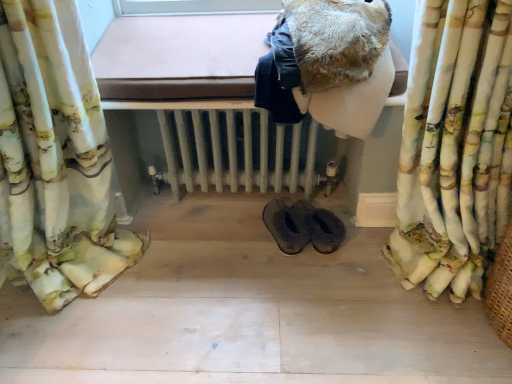
What is the approximate height of fluffy fabric curtain at right?

35.34 inches.

Measure the distance between black leather slippers at center and camera.

A distance of 1.45 meters exists between black leather slippers at center and camera.

At what (x,y) coordinates should I click in order to perform the action: click on fuzzy brown blanket at upper center. Please return your answer as a coordinate pair (x, y). The width and height of the screenshot is (512, 384). Looking at the image, I should click on (331, 65).

Is fuzzy brown blanket at upper center to the right of fluffy fabric curtain at right from the viewer's perspective?

Incorrect, fuzzy brown blanket at upper center is not on the right side of fluffy fabric curtain at right.

Is fuzzy brown blanket at upper center wider or thinner than fluffy fabric curtain at right?

Clearly, fuzzy brown blanket at upper center has more width compared to fluffy fabric curtain at right.

How much distance is there between fuzzy brown blanket at upper center and fluffy fabric curtain at right?

They are 10.81 inches apart.

Is fuzzy brown blanket at upper center bigger than fluffy fabric curtain at right?

No.

Is fuzzy brown blanket at upper center inside black leather slippers at center?

No, fuzzy brown blanket at upper center is not surrounded by black leather slippers at center.

Between black leather slippers at center and fuzzy brown blanket at upper center, which one is positioned behind?

black leather slippers at center is further away from the camera.

Looking at their sizes, would you say black leather slippers at center is wider or thinner than fuzzy brown blanket at upper center?

Clearly, black leather slippers at center has less width compared to fuzzy brown blanket at upper center.

Is black leather slippers at center next to fuzzy brown blanket at upper center and touching it?

No, black leather slippers at center is not in contact with fuzzy brown blanket at upper center.

Is point (392, 61) behind point (291, 208)?

No, (392, 61) is closer to viewer.

Does fuzzy brown blanket at upper center come behind black leather slippers at center?

No.

Considering the relative sizes of white painted radiator at center and fluffy fabric curtain at right in the image provided, is white painted radiator at center taller than fluffy fabric curtain at right?

No, white painted radiator at center is not taller than fluffy fabric curtain at right.

Can you confirm if white painted radiator at center is positioned to the left of fluffy fabric curtain at right?

Yes.

Which object is thinner, white painted radiator at center or fluffy fabric curtain at right?

fluffy fabric curtain at right.

From a real-world perspective, is white painted radiator at center physically located above or below fluffy fabric curtain at right?

Clearly, from a real-world perspective, white painted radiator at center is below fluffy fabric curtain at right.

From a real-world perspective, is fuzzy brown blanket at upper center beneath white painted radiator at center?

No, from a real-world perspective, fuzzy brown blanket at upper center is not beneath white painted radiator at center.

Between point (315, 17) and point (223, 119), which one is positioned behind?

The point (223, 119) is behind.

From the image's perspective, relative to white painted radiator at center, is fuzzy brown blanket at upper center above or below?

fuzzy brown blanket at upper center is above white painted radiator at center.

Which object is thinner, fuzzy brown blanket at upper center or white painted radiator at center?

fuzzy brown blanket at upper center.

Could you tell me if white painted radiator at center is turned towards black leather slippers at center?

No, white painted radiator at center is not turned towards black leather slippers at center.

You are a GUI agent. You are given a task and a screenshot of the screen. Output one action in this format:
    pyautogui.click(x=<x>, y=<y>)
    Task: Click on the footwear below the white painted radiator at center (from a real-world perspective)
    This screenshot has width=512, height=384.
    Given the screenshot: What is the action you would take?
    pyautogui.click(x=303, y=227)

From the image's perspective, is white painted radiator at center located beneath black leather slippers at center?

No, from the image's perspective, white painted radiator at center is not below black leather slippers at center.

How many degrees apart are the facing directions of white painted radiator at center and black leather slippers at center?

The facing directions of white painted radiator at center and black leather slippers at center are 74.2 degrees apart.

Would you consider fluffy fabric curtain at right to be distant from black leather slippers at center?

No, there isn't a large distance between fluffy fabric curtain at right and black leather slippers at center.

Does fluffy fabric curtain at right have a larger size compared to black leather slippers at center?

Correct, fluffy fabric curtain at right is larger in size than black leather slippers at center.

Consider the image. Which of these two, fluffy fabric curtain at right or black leather slippers at center, is wider?

Wider between the two is fluffy fabric curtain at right.

Is fluffy fabric curtain at right to the left or to the right of black leather slippers at center in the image?

Clearly, fluffy fabric curtain at right is on the right of black leather slippers at center in the image.

Image resolution: width=512 pixels, height=384 pixels. Find the location of `curtain that is below the fuzzy brown blanket at upper center (from the image's perspective)`. curtain that is below the fuzzy brown blanket at upper center (from the image's perspective) is located at coordinates (454, 146).

At what (x,y) coordinates should I click in order to perform the action: click on footwear behind the fuzzy brown blanket at upper center. Please return your answer as a coordinate pair (x, y). Looking at the image, I should click on (303, 227).

Estimate the real-world distances between objects in this image. Which object is closer to white painted radiator at center, fluffy fabric curtain at right or black leather slippers at center?

The object closer to white painted radiator at center is black leather slippers at center.

From the image, which object appears to be nearer to black leather slippers at center, white painted radiator at center or fluffy fabric curtain at right?

Among the two, white painted radiator at center is located nearer to black leather slippers at center.

Considering their positions, is black leather slippers at center positioned further to white painted radiator at center than fluffy fabric curtain at right?

The object further to white painted radiator at center is fluffy fabric curtain at right.

When comparing their distances from black leather slippers at center, does fluffy fabric curtain at right or white painted radiator at center seem further?

fluffy fabric curtain at right is further to black leather slippers at center.

Estimate the real-world distances between objects in this image. Which object is closer to fluffy fabric curtain at right, black leather slippers at center or white painted radiator at center?

black leather slippers at center is closer to fluffy fabric curtain at right.

From the image, which object appears to be farther from fuzzy brown blanket at upper center, fluffy fabric curtain at right or black leather slippers at center?

The object further to fuzzy brown blanket at upper center is black leather slippers at center.

Based on their spatial positions, is white painted radiator at center or fluffy fabric curtain at right closer to fuzzy brown blanket at upper center?

fluffy fabric curtain at right is positioned closer to the anchor fuzzy brown blanket at upper center.

From the image, which object appears to be farther from fluffy fabric curtain at right, black leather slippers at center or fuzzy brown blanket at upper center?

black leather slippers at center lies further to fluffy fabric curtain at right than the other object.

This screenshot has width=512, height=384. I want to click on clothing positioned between fluffy fabric curtain at right and white painted radiator at center from near to far, so click(x=331, y=65).

This screenshot has height=384, width=512. In order to click on clothing between fluffy fabric curtain at right and black leather slippers at center along the z-axis in this screenshot , I will do `click(331, 65)`.

This screenshot has height=384, width=512. Find the location of `radiator located between fluffy fabric curtain at right and black leather slippers at center in the depth direction`. radiator located between fluffy fabric curtain at right and black leather slippers at center in the depth direction is located at coordinates (238, 151).

You are a GUI agent. You are given a task and a screenshot of the screen. Output one action in this format:
    pyautogui.click(x=<x>, y=<y>)
    Task: Click on the radiator between fuzzy brown blanket at upper center and black leather slippers at center vertically
    
    Given the screenshot: What is the action you would take?
    (238, 151)